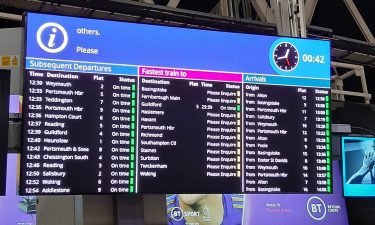
Identify the location of advertisement screen. (355, 170).